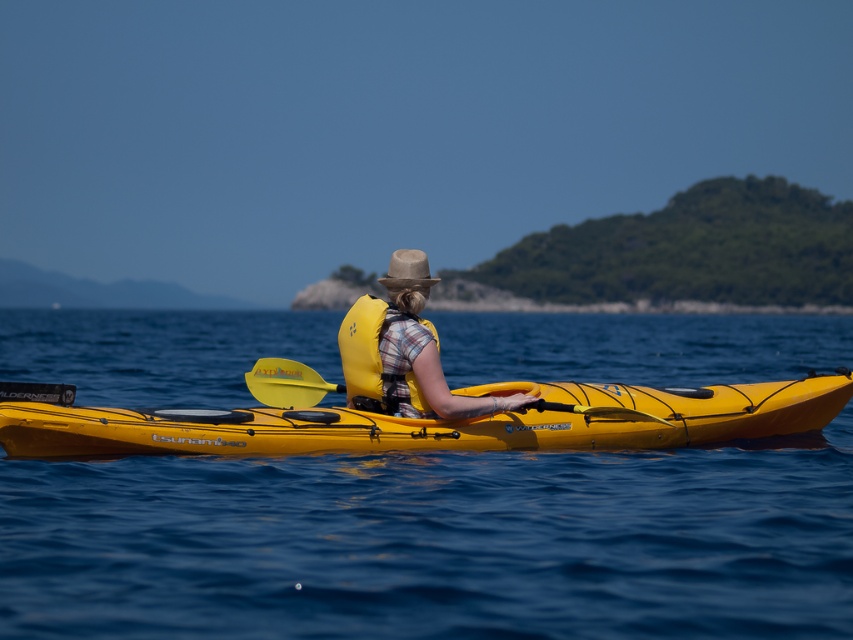
Is yellow matte life vest at center thinner than yellow plastic paddle at center?

In fact, yellow matte life vest at center might be wider than yellow plastic paddle at center.

Which is more to the right, yellow matte life vest at center or yellow plastic paddle at center?

Positioned to the right is yellow matte life vest at center.

Where is `yellow matte life vest at center`? The image size is (853, 640). yellow matte life vest at center is located at coordinates (450, 390).

Which is below, yellow matte kayak at center or yellow matte paddle at center?

yellow matte kayak at center is below.

Where is `yellow matte kayak at center`? yellow matte kayak at center is located at coordinates (438, 422).

Is yellow matte paddle at center to the right of yellow plastic paddle at center from the viewer's perspective?

Indeed, yellow matte paddle at center is positioned on the right side of yellow plastic paddle at center.

Can you confirm if yellow matte paddle at center is positioned to the left of yellow plastic paddle at center?

No, yellow matte paddle at center is not to the left of yellow plastic paddle at center.

Identify the location of yellow matte paddle at center. pyautogui.click(x=292, y=384).